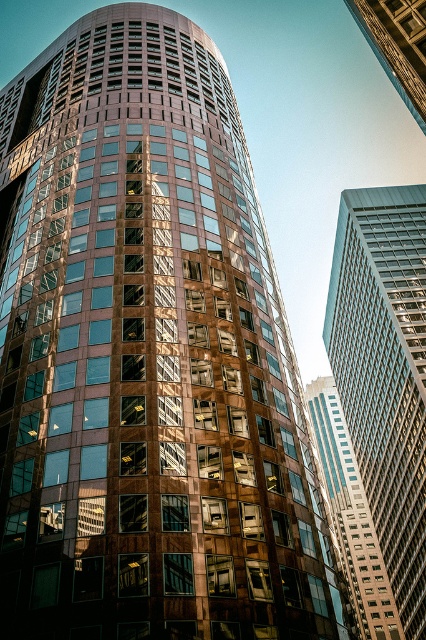
Does glossy glass skyscraper at center-right lie in front of metallic glass skyscraper at upper right?

Yes, it is in front of metallic glass skyscraper at upper right.

Between point (373, 536) and point (411, 64), which one is positioned behind?

Positioned behind is point (373, 536).

Where is `glossy glass skyscraper at center-right`? glossy glass skyscraper at center-right is located at coordinates pos(351,515).

At what (x,y) coordinates should I click in order to perform the action: click on glossy glass skyscraper at center-right. Please return your answer as a coordinate pair (x, y). This screenshot has height=640, width=426. Looking at the image, I should click on pyautogui.click(x=351, y=515).

Is glassy reflective skyscraper at right taller than metallic glass skyscraper at upper right?

Yes.

What are the coordinates of `glassy reflective skyscraper at right` in the screenshot? It's located at coord(385,372).

Identify the location of glassy reflective skyscraper at right. (385, 372).

Consider the image. Can you confirm if glassy reflective skyscraper at right is positioned to the left of glossy glass skyscraper at center-right?

No, glassy reflective skyscraper at right is not to the left of glossy glass skyscraper at center-right.

Can you confirm if glassy reflective skyscraper at right is wider than glossy glass skyscraper at center-right?

No, glassy reflective skyscraper at right is not wider than glossy glass skyscraper at center-right.

You are a GUI agent. You are given a task and a screenshot of the screen. Output one action in this format:
    pyautogui.click(x=<x>, y=<y>)
    Task: Click on the glassy reflective skyscraper at right
    
    Given the screenshot: What is the action you would take?
    pyautogui.click(x=385, y=372)